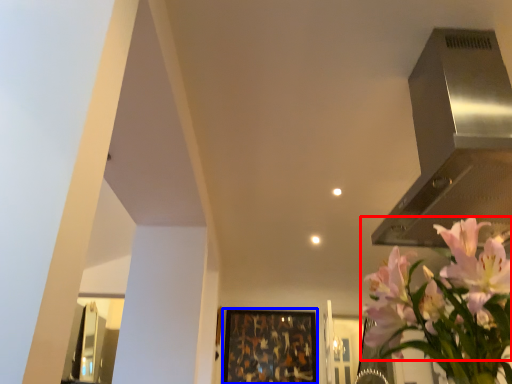
Question: Among these objects, which one is farthest to the camera, flower (highlighted by a red box) or picture frame (highlighted by a blue box)?

Choices:
 (A) flower
 (B) picture frame

Answer: (B)